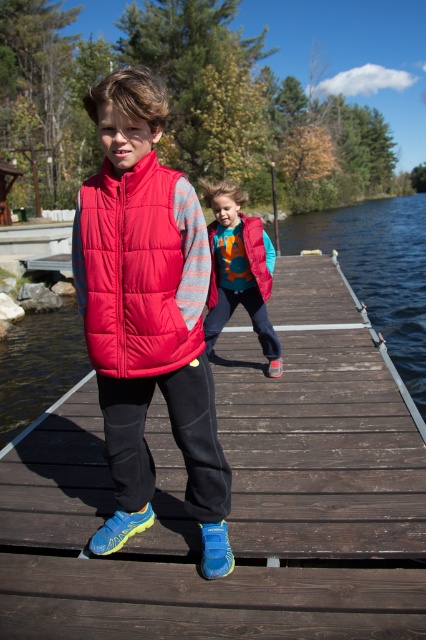
Question: Considering the real-world distances, which object is farthest from the transparent water at dock right?

Choices:
 (A) matte red puffer vest at center
 (B) wooden dock at center

Answer: (B)

Question: Considering the relative positions of matte red vest at center and transparent water at dock right in the image provided, where is matte red vest at center located with respect to transparent water at dock right?

Choices:
 (A) above
 (B) below

Answer: (B)

Question: Which point is closer to the camera?

Choices:
 (A) (180, 253)
 (B) (282, 225)
 (C) (239, 241)
 (D) (80, 326)

Answer: (A)

Question: Does matte red vest at center appear on the left side of matte red puffer vest at center?

Choices:
 (A) yes
 (B) no

Answer: (B)

Question: Is matte red puffer vest at center to the right of matte pink vest at center from the viewer's perspective?

Choices:
 (A) yes
 (B) no

Answer: (B)

Question: Which of the following is the closest to the observer?

Choices:
 (A) (141, 388)
 (B) (400, 240)
 (C) (256, 237)
 (D) (409, 284)

Answer: (A)